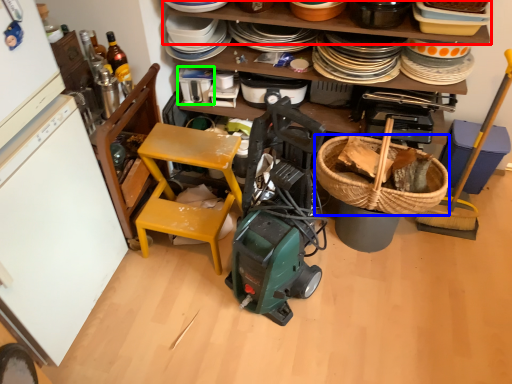
Question: Estimate the real-world distances between objects in this image. Which object is closer to shelf (highlighted by a red box), picnic basket (highlighted by a blue box) or appliance (highlighted by a green box)?

Choices:
 (A) picnic basket
 (B) appliance

Answer: (B)